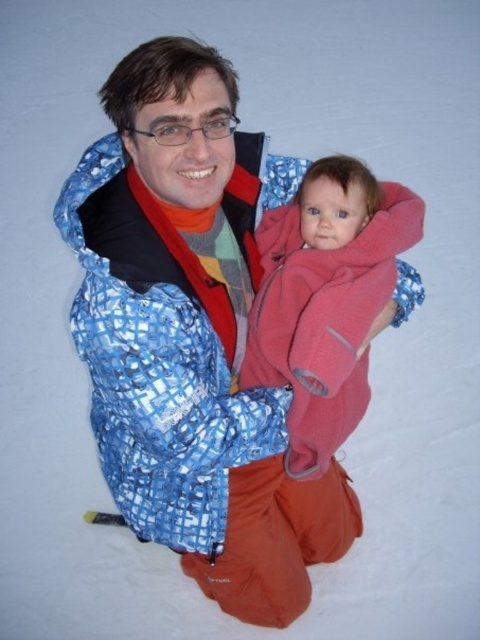
Between blue checkered jacket at center and soft pink fleece at center, which one appears on the left side from the viewer's perspective?

Positioned to the left is blue checkered jacket at center.

Measure the distance from blue checkered jacket at center to soft pink fleece at center.

A distance of 8.50 inches exists between blue checkered jacket at center and soft pink fleece at center.

Where is `blue checkered jacket at center`? blue checkered jacket at center is located at coordinates (190, 339).